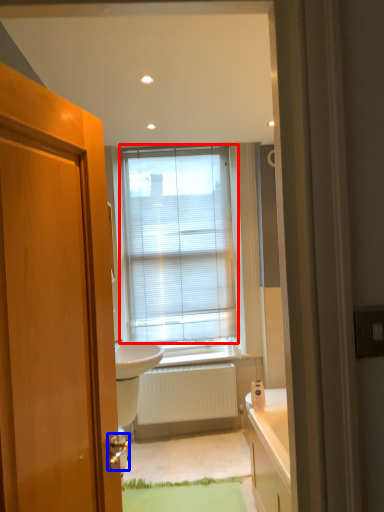
Question: Among these objects, which one is farthest to the camera, window blind (highlighted by a red box) or door handle (highlighted by a blue box)?

Choices:
 (A) window blind
 (B) door handle

Answer: (A)